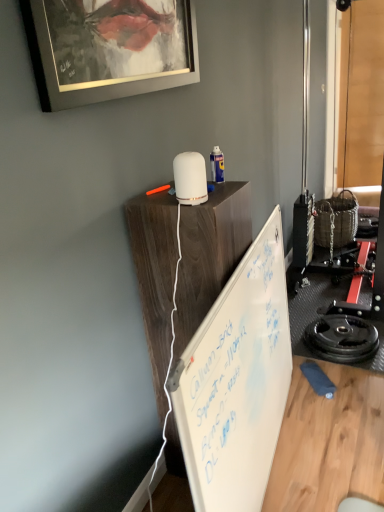
Question: Considering the relative sizes of whiteboard at center and black rubber weight plate at lower right in the image provided, is whiteboard at center shorter than black rubber weight plate at lower right?

Choices:
 (A) yes
 (B) no

Answer: (A)

Question: From the image's perspective, is whiteboard at center on black rubber weight plate at lower right?

Choices:
 (A) no
 (B) yes

Answer: (B)

Question: Would you say whiteboard at center is a long distance from black rubber weight plate at lower right?

Choices:
 (A) no
 (B) yes

Answer: (A)

Question: Could you tell me if whiteboard at center is turned towards black rubber weight plate at lower right?

Choices:
 (A) yes
 (B) no

Answer: (B)

Question: Would you say whiteboard at center contains black rubber weight plate at lower right?

Choices:
 (A) yes
 (B) no

Answer: (B)

Question: From the image's perspective, is black rubber weight plate at lower right positioned above or below white matte wood table at upper center?

Choices:
 (A) above
 (B) below

Answer: (B)

Question: Is black rubber weight plate at lower right spatially inside white matte wood table at upper center, or outside of it?

Choices:
 (A) outside
 (B) inside

Answer: (A)

Question: Looking at the image, does black rubber weight plate at lower right seem bigger or smaller compared to white matte wood table at upper center?

Choices:
 (A) big
 (B) small

Answer: (B)

Question: Relative to white matte wood table at upper center, is black rubber weight plate at lower right in front or behind?

Choices:
 (A) behind
 (B) front

Answer: (A)

Question: Is point (195, 200) closer or farther from the camera than point (251, 381)?

Choices:
 (A) closer
 (B) farther

Answer: (A)

Question: Based on their positions, is white matte diffuser at upper center located to the left or right of whiteboard at center?

Choices:
 (A) left
 (B) right

Answer: (A)

Question: From the image's perspective, is white matte diffuser at upper center located above or below whiteboard at center?

Choices:
 (A) below
 (B) above

Answer: (B)

Question: From their relative heights in the image, would you say white matte diffuser at upper center is taller or shorter than whiteboard at center?

Choices:
 (A) short
 (B) tall

Answer: (B)

Question: Is white matte wood table at upper center in front of or behind black rubber weight plate at lower right in the image?

Choices:
 (A) front
 (B) behind

Answer: (A)

Question: Do you think white matte wood table at upper center is within black rubber weight plate at lower right, or outside of it?

Choices:
 (A) outside
 (B) inside

Answer: (A)